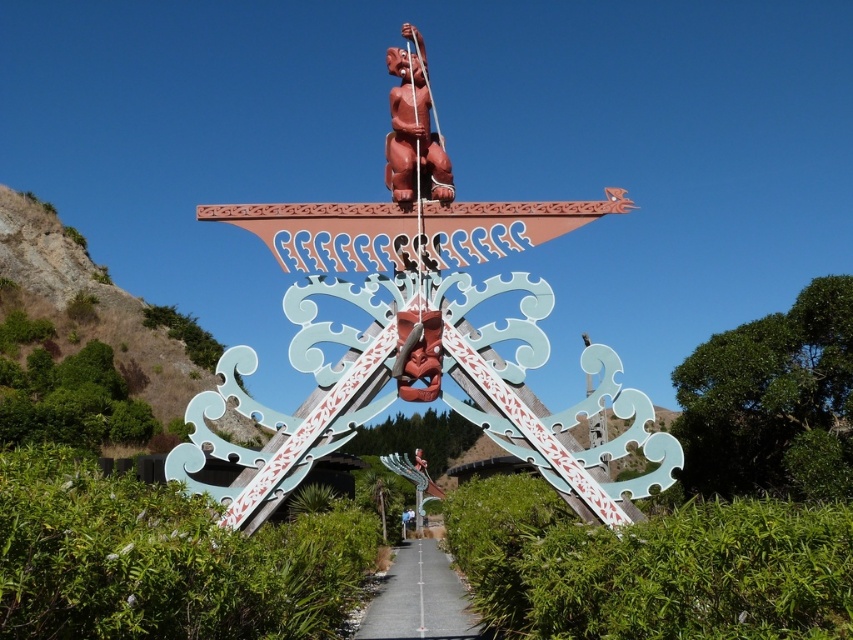
Question: Is green leafy hedge at center in front of green leafy hedge at lower center?

Choices:
 (A) yes
 (B) no

Answer: (A)

Question: Estimate the real-world distances between objects in this image. Which object is farther from the matte red totem pole at center?

Choices:
 (A) matte red totem pole at upper center
 (B) green leafy hedge at center
 (C) gray concrete path at center
 (D) green leafy hedge at right

Answer: (D)

Question: Estimate the real-world distances between objects in this image. Which object is farther from the green leafy hedge at lower center?

Choices:
 (A) gray concrete path at center
 (B) green leafy hedge at right
 (C) green leafy hedge at center

Answer: (C)

Question: Which of the following is the closest to the observer?

Choices:
 (A) (421, 193)
 (B) (793, 554)
 (C) (123, 628)

Answer: (C)

Question: Is matte red totem pole at center to the right of green leafy hedge at center from the viewer's perspective?

Choices:
 (A) no
 (B) yes

Answer: (B)

Question: Does green leafy hedge at lower center have a greater width compared to gray concrete path at center?

Choices:
 (A) yes
 (B) no

Answer: (A)